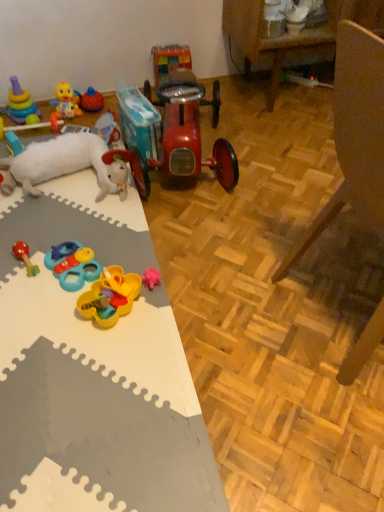
Identify the location of free spot above white foam mat at left (from a real-world perspective). (83, 318).